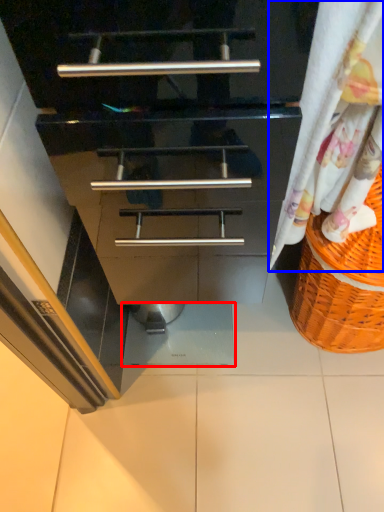
Question: Among these objects, which one is nearest to the camera, tile (highlighted by a red box) or curtain (highlighted by a blue box)?

Choices:
 (A) tile
 (B) curtain

Answer: (B)